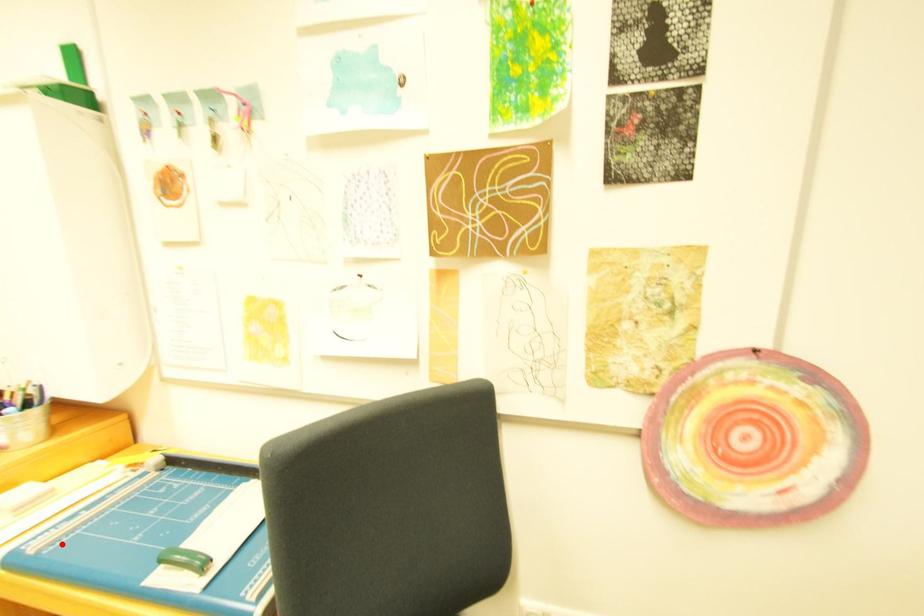
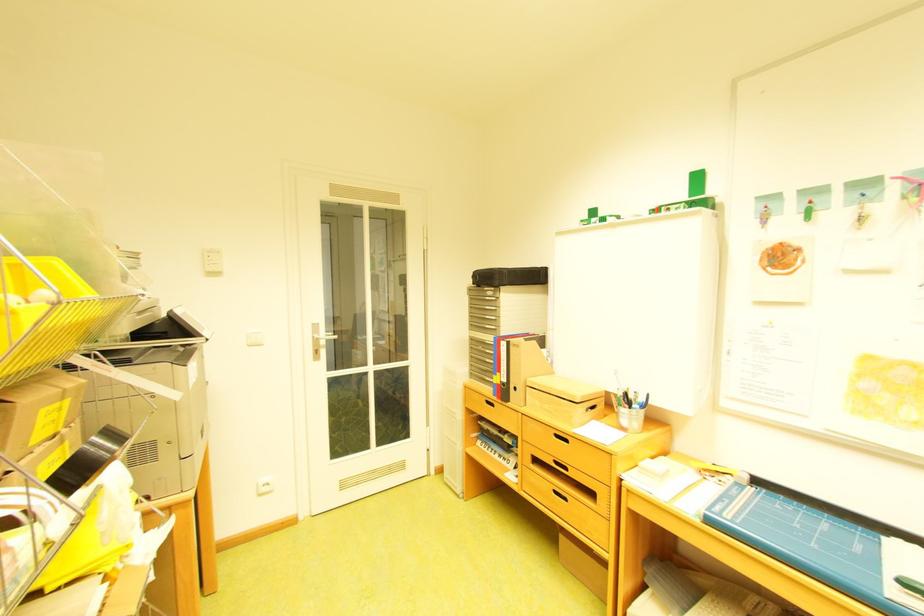
Question: A red point is marked in image1. In image2, is the corresponding 3D point closer to the camera or farther? Reply with the corresponding letter.

Choices:
 (A) The corresponding 3D point is closer.
 (B) The corresponding 3D point is farther.

Answer: (B)